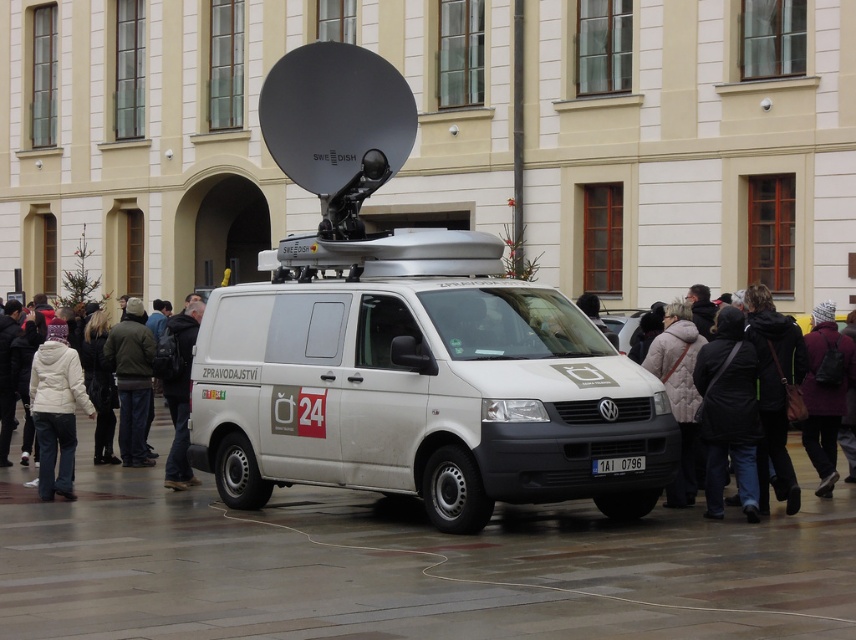
Which is behind, point (58, 344) or point (801, 428)?

Point (801, 428)

Describe the element at coordinates (56, 410) in the screenshot. Image resolution: width=856 pixels, height=640 pixels. I see `white fleece jacket at left` at that location.

Image resolution: width=856 pixels, height=640 pixels. Identify the location of white fleece jacket at left. (56, 410).

Is dark purple jacket at lower right closer to the viewer compared to black leather jacket at center?

Yes, dark purple jacket at lower right is in front of black leather jacket at center.

Is dark purple jacket at lower right to the left of black leather jacket at center from the viewer's perspective?

Incorrect, dark purple jacket at lower right is not on the left side of black leather jacket at center.

What do you see at coordinates (825, 392) in the screenshot? The width and height of the screenshot is (856, 640). I see `dark purple jacket at lower right` at bounding box center [825, 392].

Locate an element on the screen. dark purple jacket at lower right is located at coordinates (825, 392).

Who is higher up, white fleece jacket at left or dark brown leather jacket at left?

white fleece jacket at left

Based on the photo, is white fleece jacket at left smaller than dark brown leather jacket at left?

Yes, white fleece jacket at left is smaller than dark brown leather jacket at left.

Is point (34, 360) positioned before point (141, 360)?

Yes.

The image size is (856, 640). I want to click on white fleece jacket at left, so click(x=56, y=410).